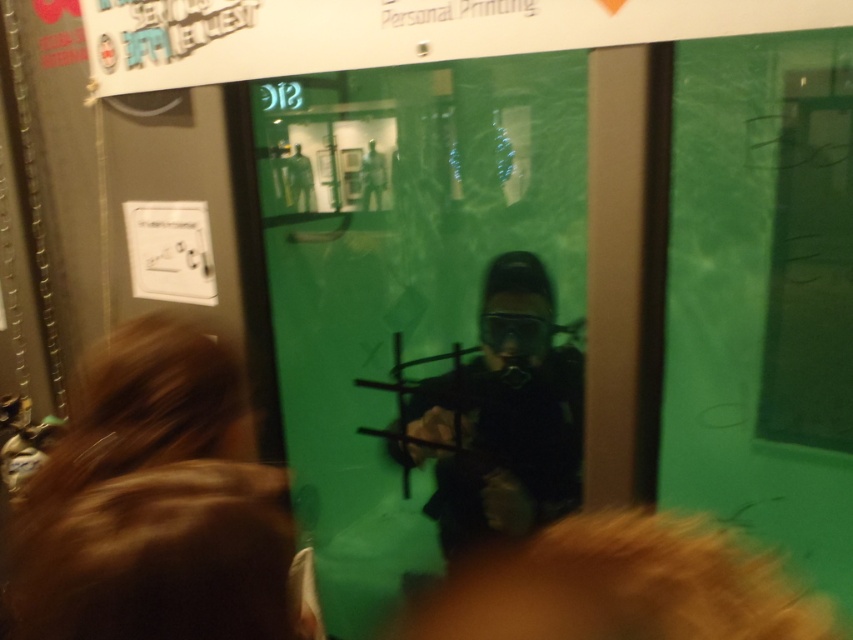
Does point (782, 266) come closer to viewer compared to point (459, 474)?

Yes, point (782, 266) is closer to viewer.

Looking at this image, is green matte glass door at center closer to camera compared to black matte diving suit at center?

Yes, it is.

Which is behind, point (373, 131) or point (537, 269)?

The point (373, 131) is behind.

Where is `green matte glass door at center`? green matte glass door at center is located at coordinates (425, 308).